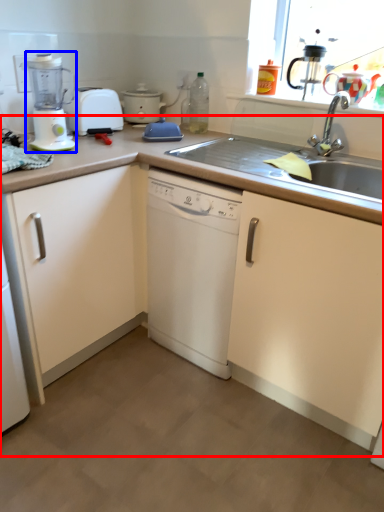
Question: Which point is further to the camera, counter (highlighted by a red box) or kitchen appliance (highlighted by a blue box)?

Choices:
 (A) counter
 (B) kitchen appliance

Answer: (B)